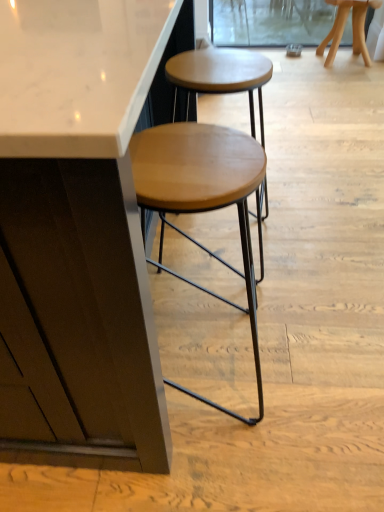
Question: In the image, is wooden stool at upper right, the first stool in the back-to-front sequence, positioned in front of or behind transparent glass screen door at upper center?

Choices:
 (A) behind
 (B) front

Answer: (B)

Question: Based on their sizes in the image, would you say wooden stool at upper right, which is counted as the first stool, starting from the top, is bigger or smaller than transparent glass screen door at upper center?

Choices:
 (A) small
 (B) big

Answer: (B)

Question: Based on their relative distances, which object is farther from the wooden seat at center, the first stool in the front-to-back sequence?

Choices:
 (A) transparent glass screen door at upper center
 (B) wooden stool at upper right, the first stool in the back-to-front sequence

Answer: (A)

Question: Which object is positioned closest to the transparent glass screen door at upper center?

Choices:
 (A) wooden seat at center, the 1th stool from the left
 (B) wooden stool at upper right, which is the second stool from left to right

Answer: (B)